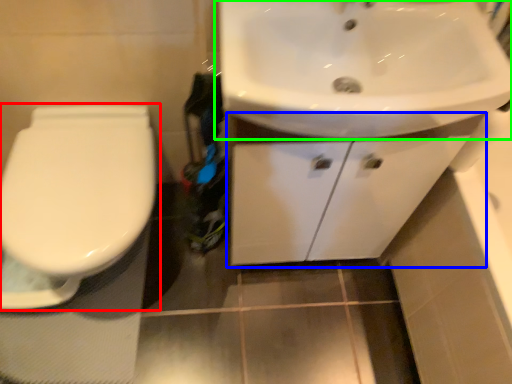
Question: Which object is the closest to the toilet (highlighted by a red box)? Choose among these: bathroom cabinet (highlighted by a blue box) or sink (highlighted by a green box).

Choices:
 (A) bathroom cabinet
 (B) sink

Answer: (A)